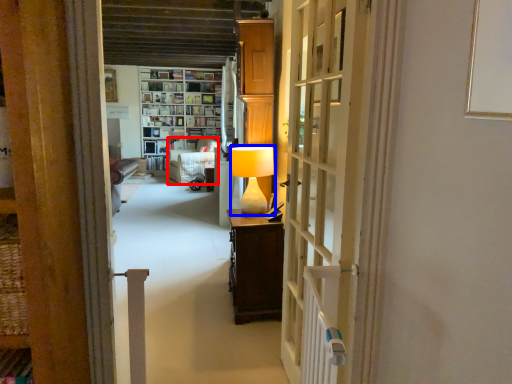
Question: Which point is closer to the camera, armchair (highlighted by a red box) or table lamp (highlighted by a blue box)?

Choices:
 (A) armchair
 (B) table lamp

Answer: (B)